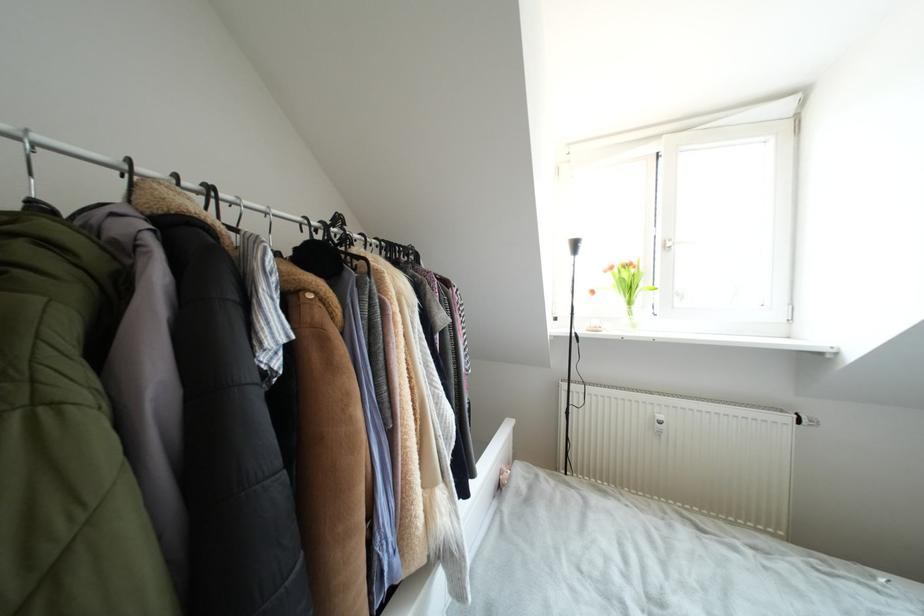
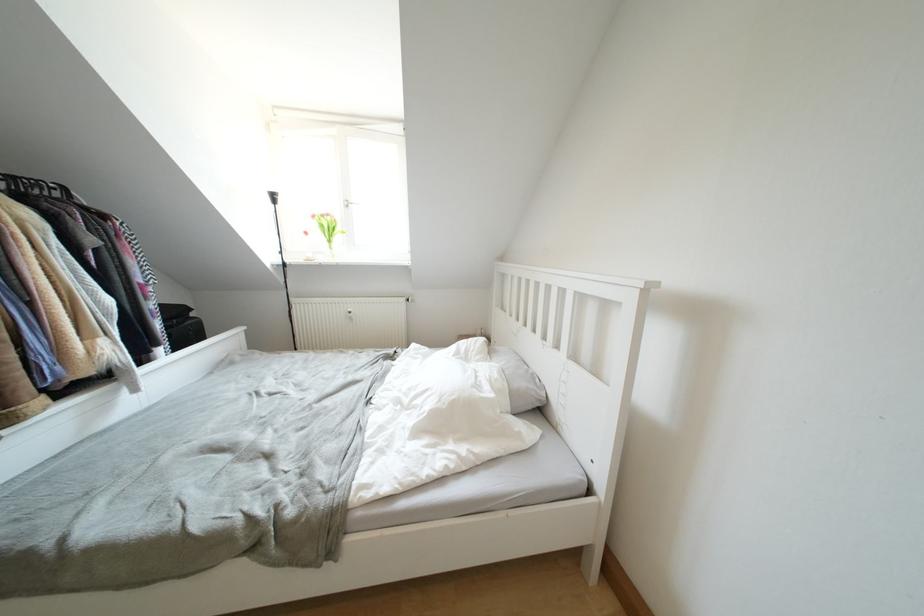
Where in the second image is the point corresponding to point 616,272 from the first image?

(319, 220)